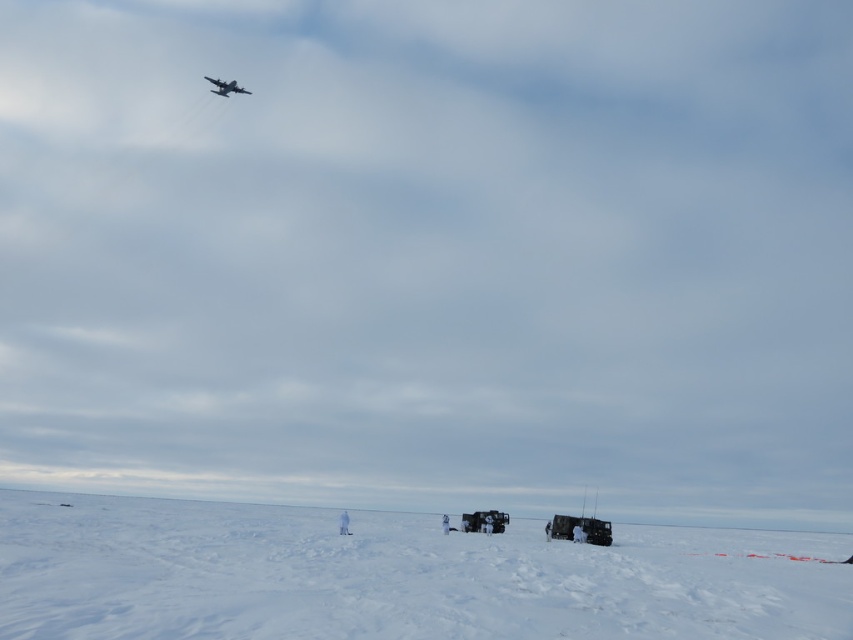
You are a photographer trying to capture both the metallic silver aircraft at upper left and the white matte skier at lower center in a single shot. Considering their sizes, which object will appear larger in your photo?

The metallic silver aircraft at upper left will appear larger in the photo because it is taller than the white matte skier at lower center.